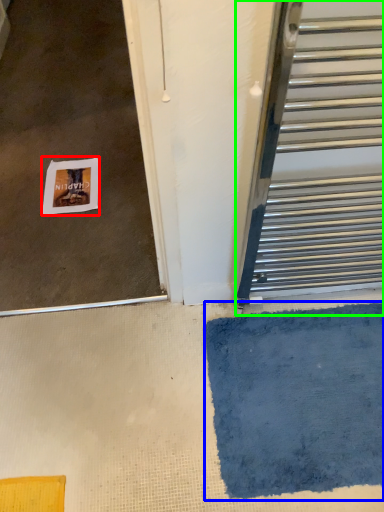
Question: Based on their relative distances, which object is nearer to postcard (highlighted by a red box)? Choose from bath mat (highlighted by a blue box) and door (highlighted by a green box).

Choices:
 (A) bath mat
 (B) door

Answer: (B)